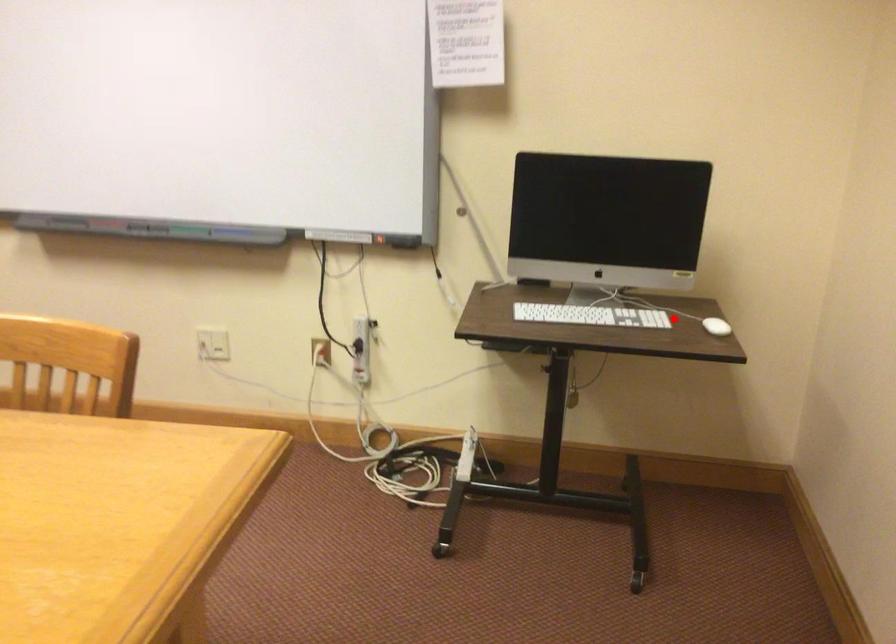
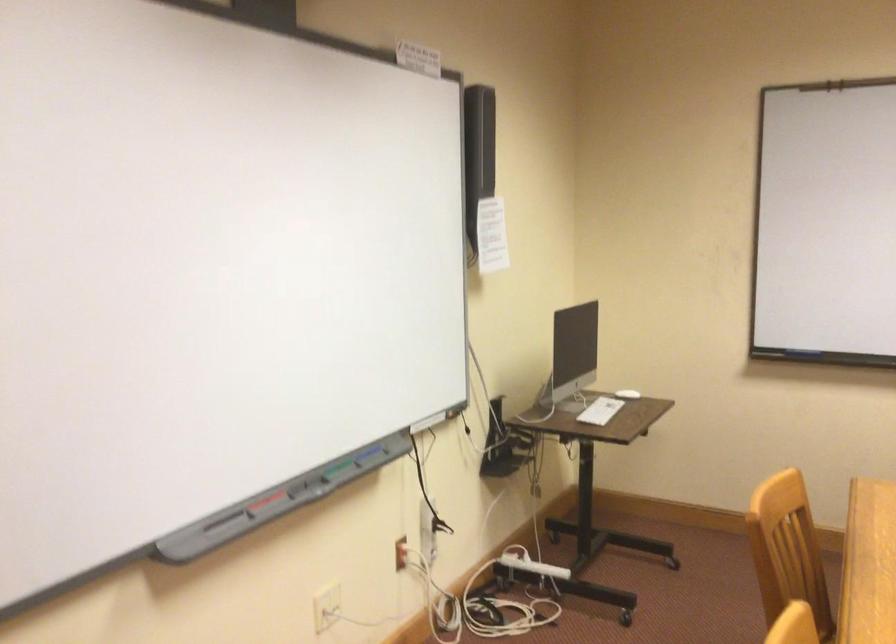
Where in the second image is the point corresponding to the highlighted location from the first image?

(627, 393)